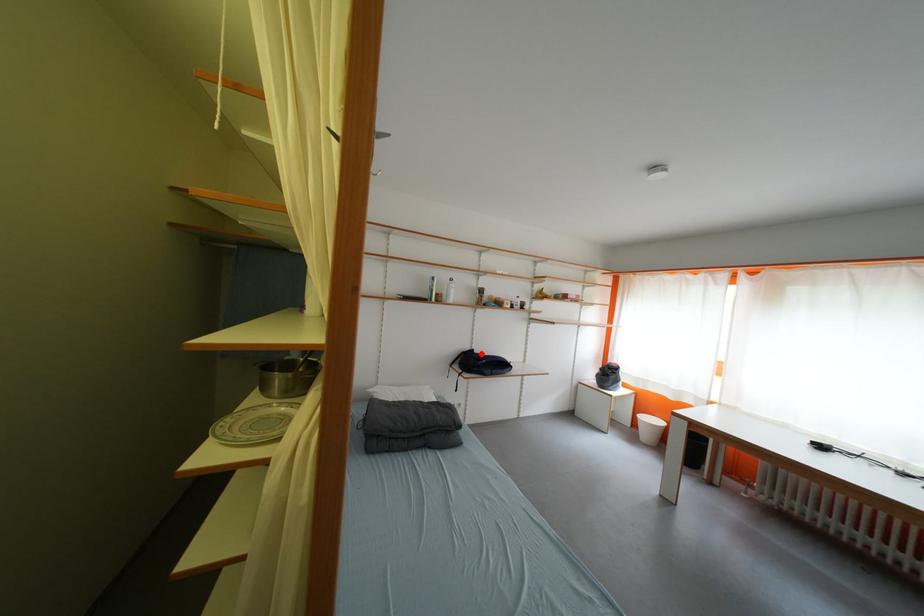
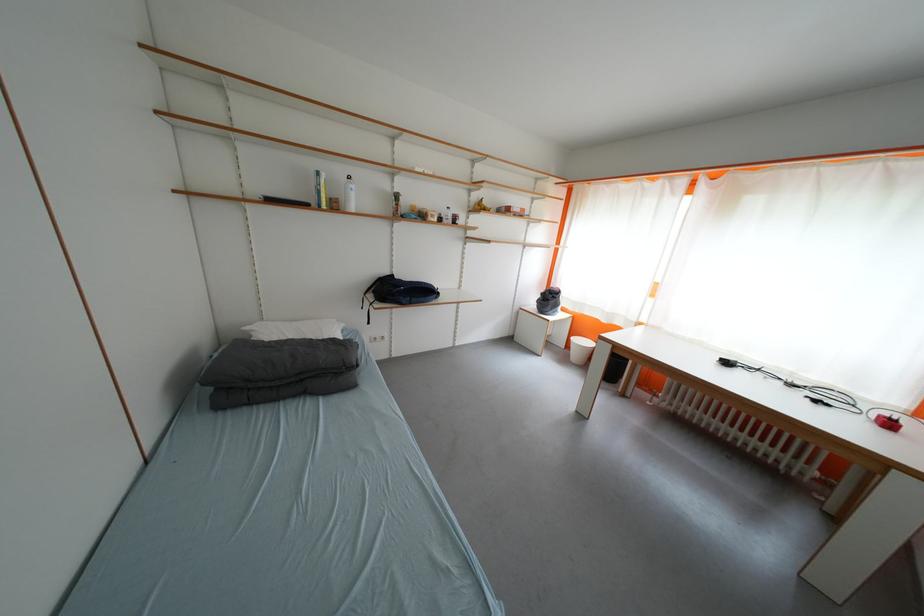
Find the pixel in the second image that matches the highlighted location in the first image.

(400, 278)